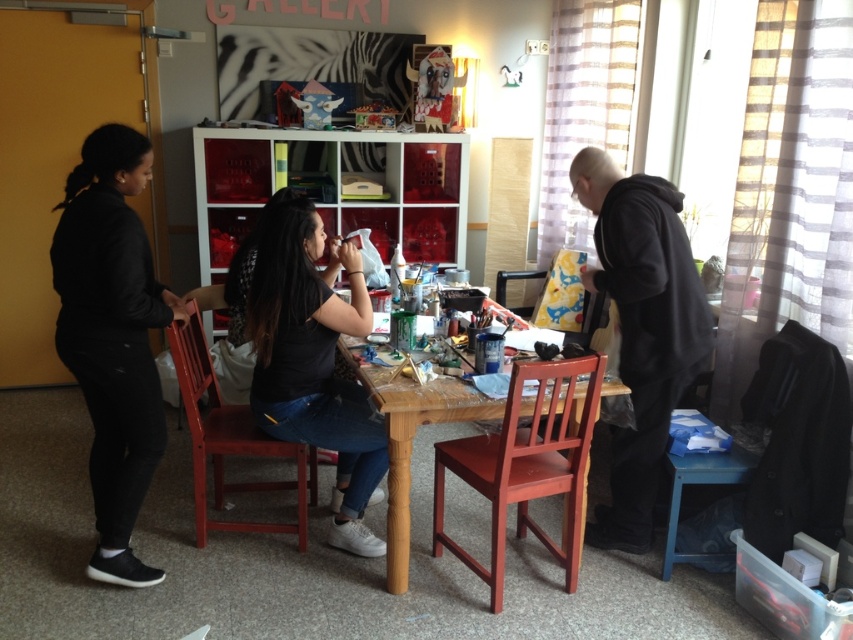
You are an observer in the room. You notice the black matte pants at left and the black matte shirt at center. Which one is positioned higher in the image?

The black matte pants at left is above the black matte shirt at center in the image.

You are organizing a small art exhibition in this room and need to ensure there is enough space for attendees to move around. Based on the image, which of the two items, the black matte pants at left or the black matte shirt at center, takes up more floor space?

The black matte shirt at center takes up more floor space than the black matte pants at left, as the black matte pants at left occupies less space than black matte shirt at center.